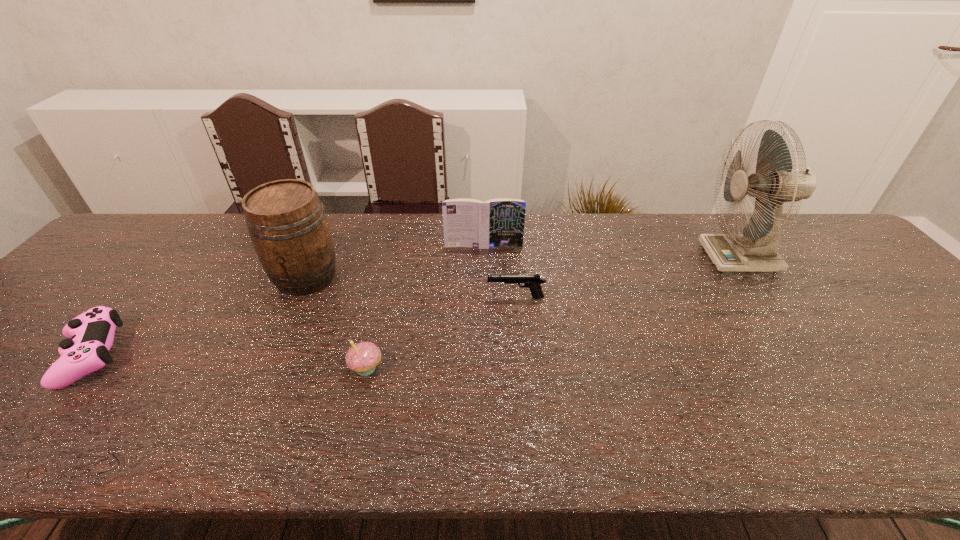
Locate an element on the screen. This screenshot has width=960, height=540. fan is located at coordinates (775, 182).

I want to click on the tallest object, so click(x=775, y=182).

Identify the location of the second tallest object. Image resolution: width=960 pixels, height=540 pixels. (287, 224).

This screenshot has height=540, width=960. In order to click on cider in this screenshot , I will do `click(287, 224)`.

The width and height of the screenshot is (960, 540). I want to click on the fourth shortest object, so click(499, 222).

You are a GUI agent. You are given a task and a screenshot of the screen. Output one action in this format:
    pyautogui.click(x=<x>, y=<y>)
    Task: Click on the third object from left to right
    
    Given the screenshot: What is the action you would take?
    pyautogui.click(x=363, y=358)

Identify the location of cupcake. The image size is (960, 540). (363, 358).

I want to click on gun, so pos(533,282).

What are the coordinates of `control` in the screenshot? It's located at (90, 335).

Image resolution: width=960 pixels, height=540 pixels. Identify the location of free spot located on the front-facing side of the tallest object. (682, 258).